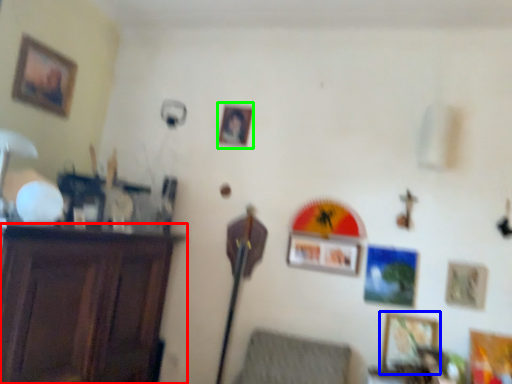
Question: Considering the real-world distances, which object is closest to furniture (highlighted by a red box)? picture frame (highlighted by a blue box) or picture frame (highlighted by a green box).

Choices:
 (A) picture frame
 (B) picture frame

Answer: (B)